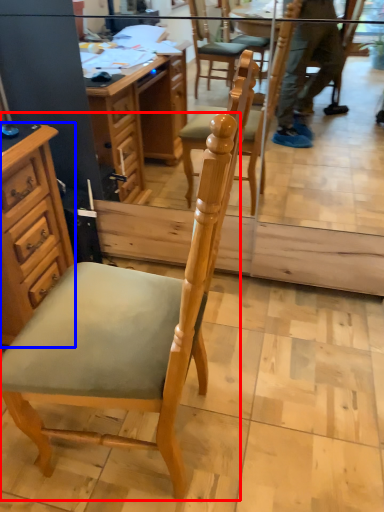
Question: Which of the following is the closest to the observer, chair (highlighted by a red box) or cabinetry (highlighted by a blue box)?

Choices:
 (A) chair
 (B) cabinetry

Answer: (A)